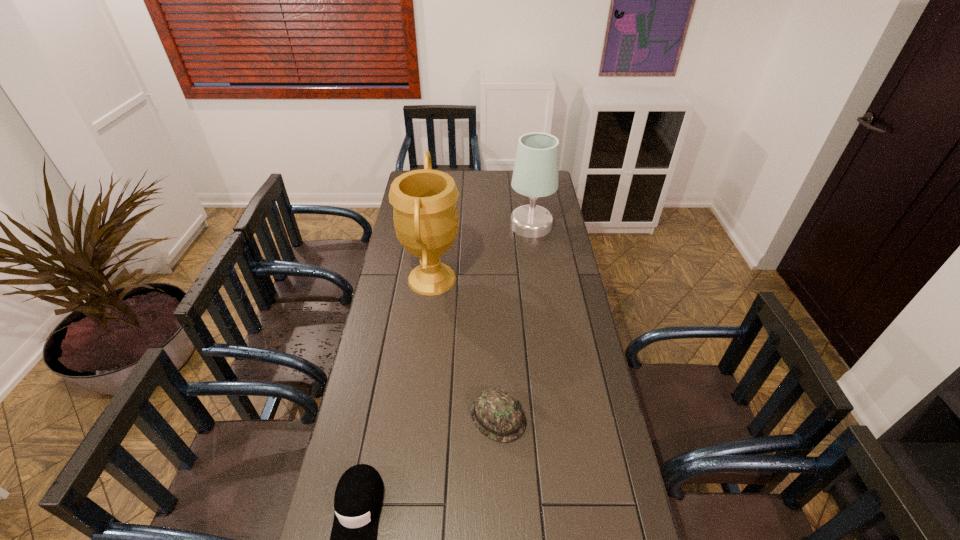
Locate an element on the screen. Image resolution: width=960 pixels, height=540 pixels. vacant space that satisfies the following two spatial constraints: 1. on the engravings side of the second nearest object; 2. on the right side of the trophy is located at coordinates (416, 417).

Locate an element on the screen. The image size is (960, 540). vacant space that satisfies the following two spatial constraints: 1. on the engravings side of the third farthest object; 2. on the right side of the trophy is located at coordinates (416, 417).